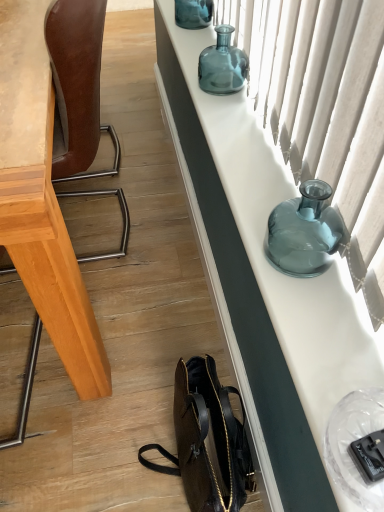
Where is `vacant space behind brown leather chair at left`? vacant space behind brown leather chair at left is located at coordinates (126, 163).